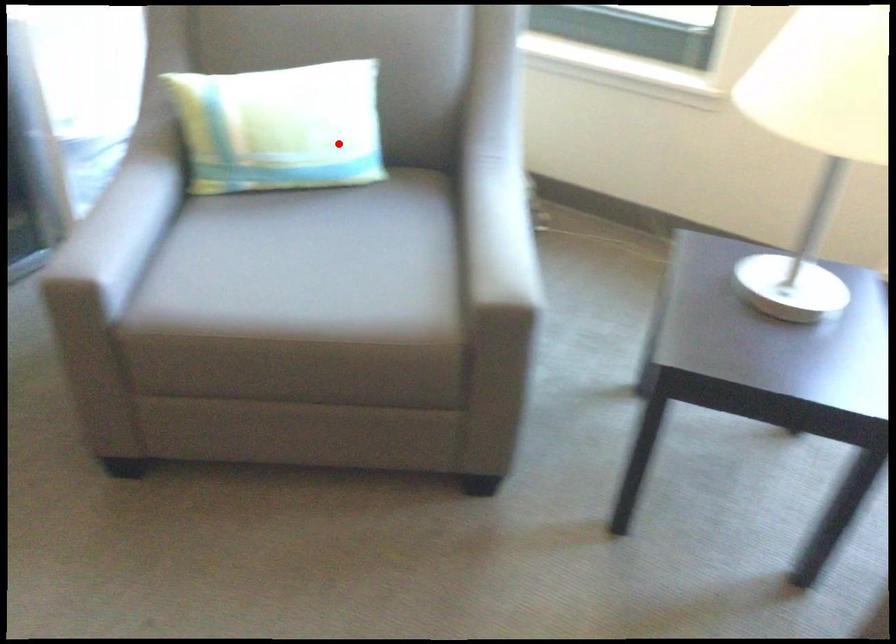
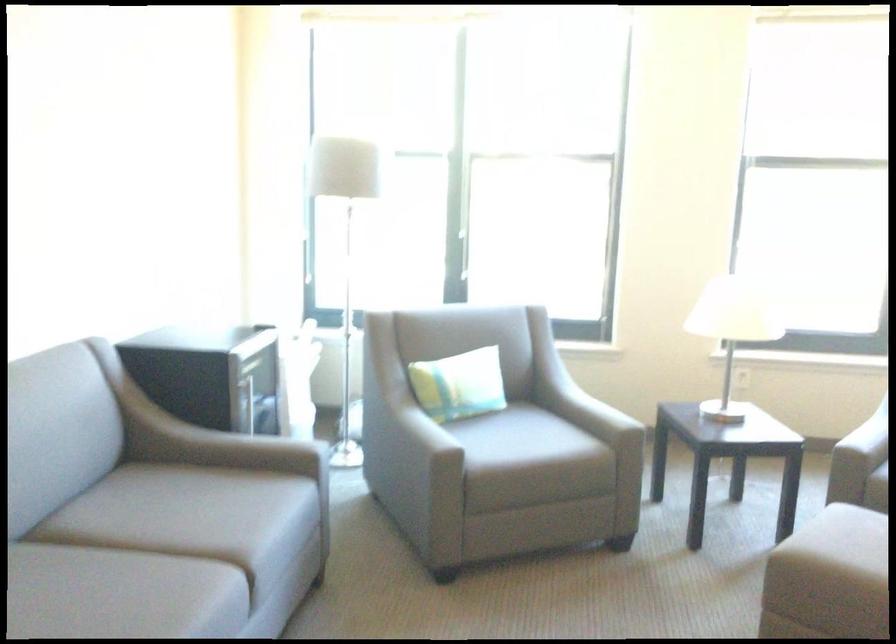
In the second image, find the point that corresponds to the highlighted location in the first image.

(459, 384)